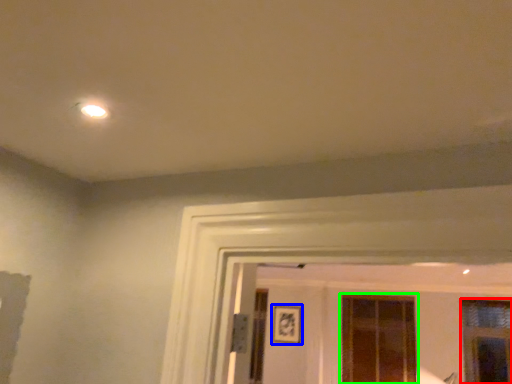
Question: Considering the real-world distances, which object is farthest from window (highlighted by a red box)? picture frame (highlighted by a blue box) or window (highlighted by a green box)?

Choices:
 (A) picture frame
 (B) window

Answer: (A)